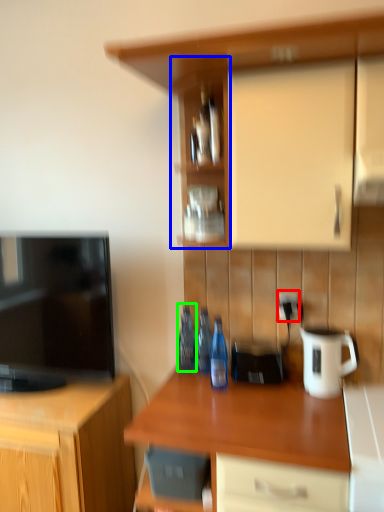
Question: Considering the real-world distances, which object is closest to electric outlet (highlighted by a red box)? shelf (highlighted by a blue box) or bottle (highlighted by a green box).

Choices:
 (A) shelf
 (B) bottle

Answer: (B)